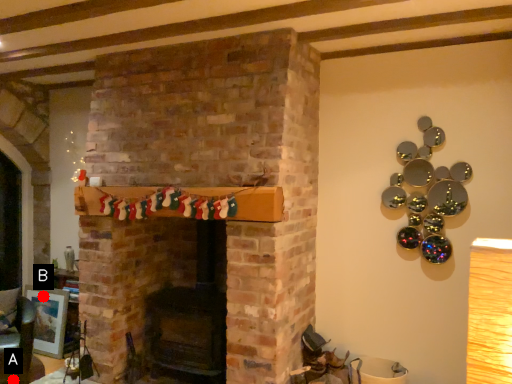
Question: Two points are circled on the image, labeled by A and B beside each circle. Which point appears farthest from the camera in this image?

Choices:
 (A) A is further
 (B) B is further

Answer: (B)